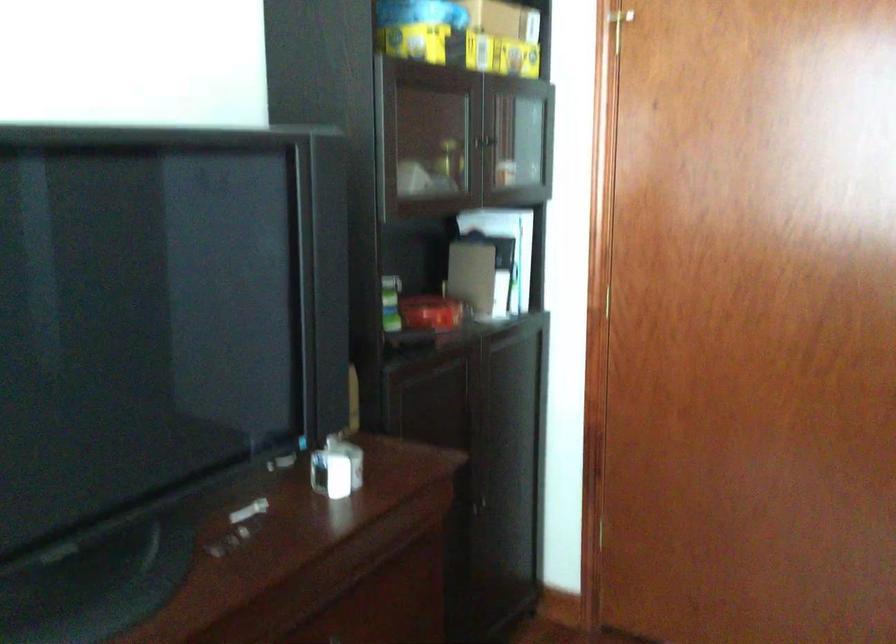
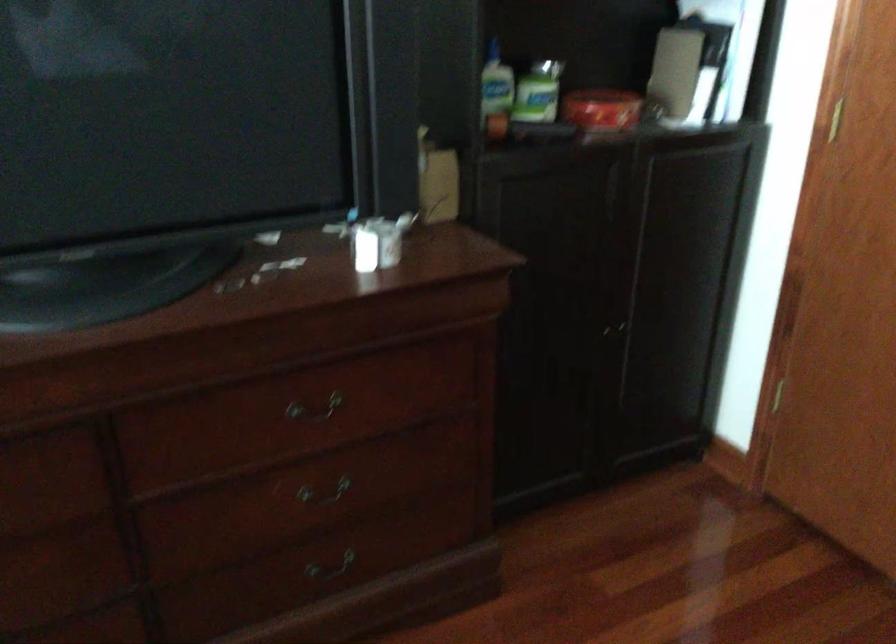
The point at (343, 465) is marked in the first image. Where is the corresponding point in the second image?

(378, 242)